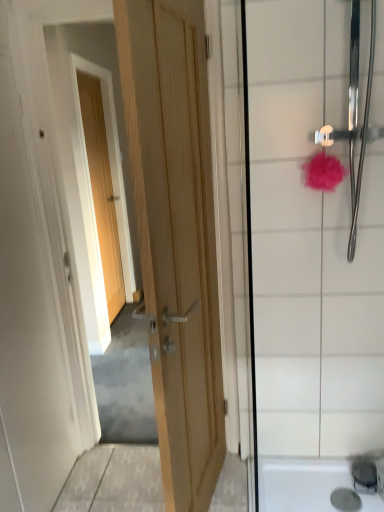
Question: Is the position of wooden door at center, arranged as the first door when viewed from the front, less distant than that of satin nickel faucet at lower right?

Choices:
 (A) yes
 (B) no

Answer: (A)

Question: From the image's perspective, is wooden door at center, the 2th door from the back, under satin nickel faucet at lower right?

Choices:
 (A) yes
 (B) no

Answer: (B)

Question: Does wooden door at center, arranged as the 1th door when viewed from the right, lie behind satin nickel faucet at lower right?

Choices:
 (A) yes
 (B) no

Answer: (B)

Question: Are wooden door at center, which ranks as the 2th door in left-to-right order, and satin nickel faucet at lower right making contact?

Choices:
 (A) yes
 (B) no

Answer: (B)

Question: Can you confirm if wooden door at center, arranged as the 1th door when viewed from the right, is thinner than satin nickel faucet at lower right?

Choices:
 (A) yes
 (B) no

Answer: (B)

Question: Can we say wooden door at center, arranged as the first door when viewed from the front, lies outside satin nickel faucet at lower right?

Choices:
 (A) yes
 (B) no

Answer: (A)

Question: From a real-world perspective, is pink fluffy sponge at upper right physically above white glossy shower door at right?

Choices:
 (A) yes
 (B) no

Answer: (A)

Question: Is pink fluffy sponge at upper right far away from white glossy shower door at right?

Choices:
 (A) yes
 (B) no

Answer: (B)

Question: From the image's perspective, is pink fluffy sponge at upper right under white glossy shower door at right?

Choices:
 (A) yes
 (B) no

Answer: (B)

Question: Considering the relative sizes of pink fluffy sponge at upper right and white glossy shower door at right in the image provided, is pink fluffy sponge at upper right bigger than white glossy shower door at right?

Choices:
 (A) no
 (B) yes

Answer: (B)

Question: Is pink fluffy sponge at upper right positioned with its back to white glossy shower door at right?

Choices:
 (A) no
 (B) yes

Answer: (B)

Question: Can you confirm if pink fluffy sponge at upper right is shorter than white glossy shower door at right?

Choices:
 (A) no
 (B) yes

Answer: (B)

Question: Does pink fluffy sponge at upper right have a greater width compared to light wood door at upper left, which is counted as the first door, starting from the back?

Choices:
 (A) no
 (B) yes

Answer: (B)